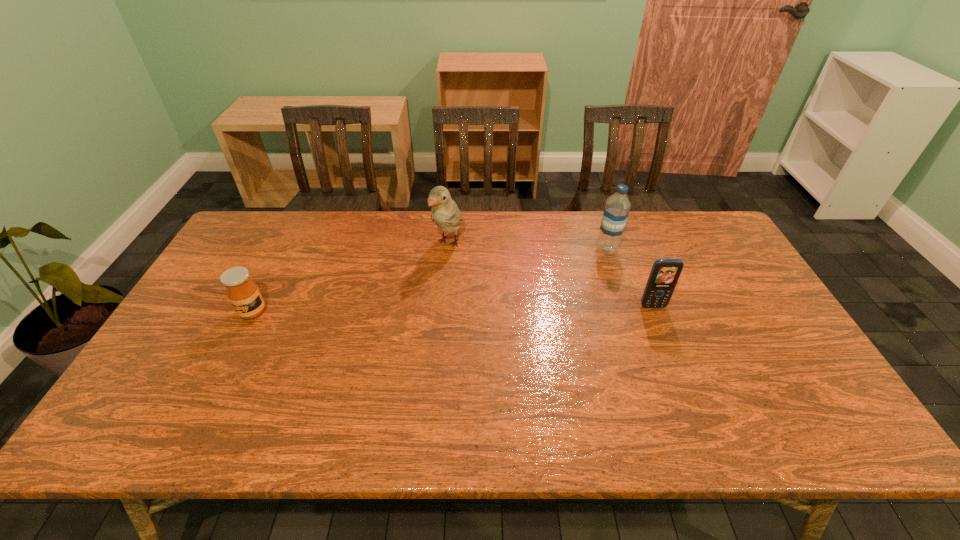
Find the location of a particular element. This screenshot has width=960, height=540. free space on the desktop that is between the leftmost object and the cellular telephone and is positioned on the label of the third object from left to right is located at coordinates (504, 308).

At what (x,y) coordinates should I click in order to perform the action: click on vacant space on the desktop that is between the honey and the third tallest object and is positioned at the face of the third object from right to left. Please return your answer as a coordinate pair (x, y). Looking at the image, I should click on (398, 310).